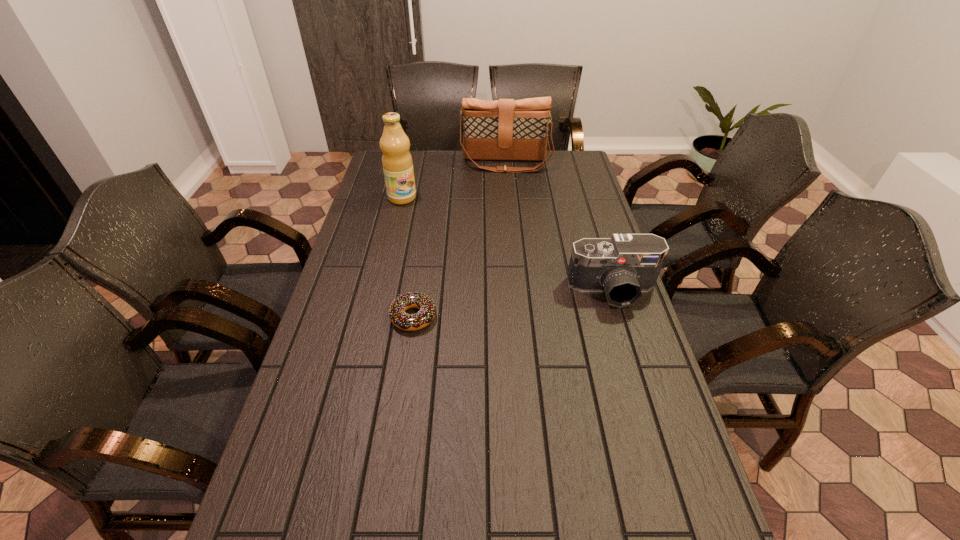
The image size is (960, 540). I want to click on vacant space on the desktop that is between the shortest object and the camera and is positioned on the front-facing side of the shoulder bag, so click(508, 305).

Image resolution: width=960 pixels, height=540 pixels. I want to click on free space on the desktop that is between the doughnut and the third tallest object and is positioned on the label of the tallest object, so click(x=493, y=306).